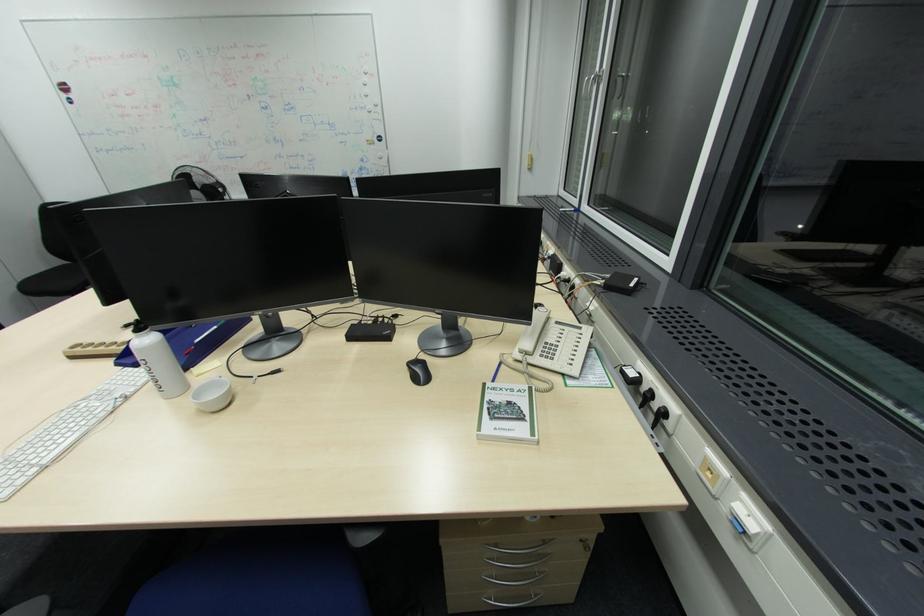
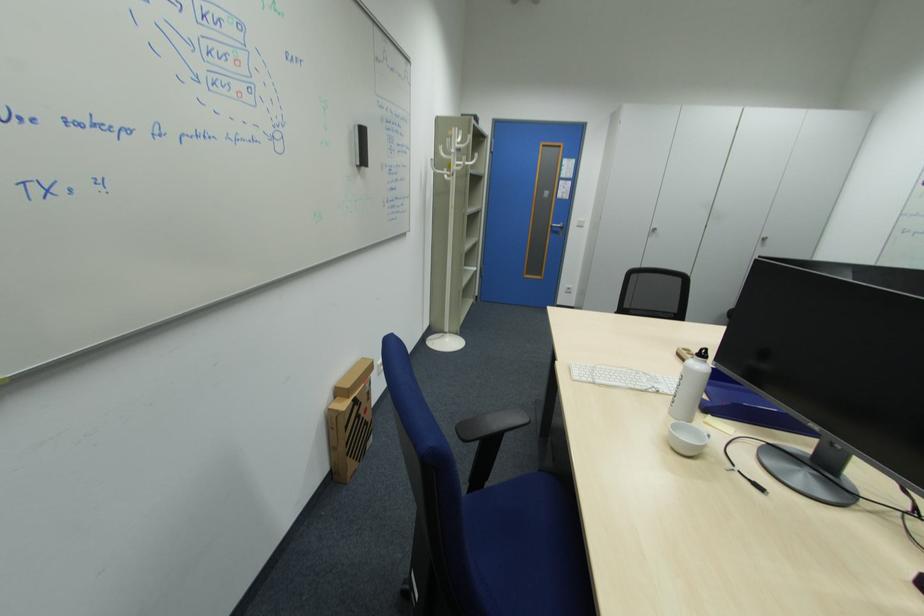
The first image is from the beginning of the video and the second image is from the end. How did the camera likely rotate when shooting the video?

The camera's rotation is toward left-down.